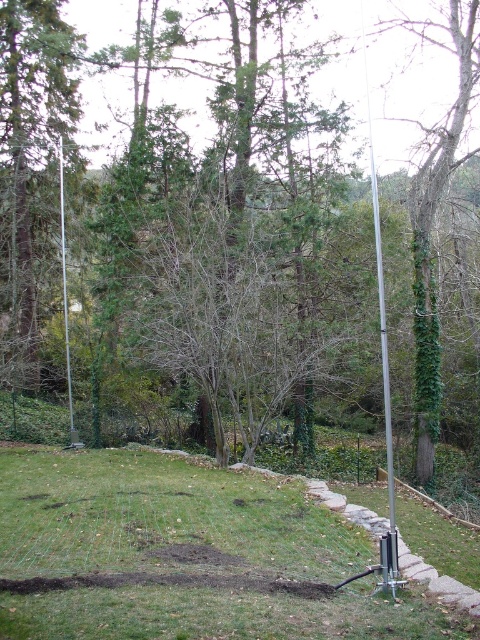
Question: Does green grass at center appear on the left side of silver metallic pole at center?

Choices:
 (A) no
 (B) yes

Answer: (A)

Question: Estimate the real-world distances between objects in this image. Which object is farther from the green grass at center?

Choices:
 (A) silver metallic pole at center
 (B) silver metallic pole at right

Answer: (A)

Question: In this image, where is green grass at center located relative to green ivy-covered tree at right?

Choices:
 (A) above
 (B) below

Answer: (B)

Question: Can you confirm if green ivy-covered tree at right is wider than silver metallic pole at center?

Choices:
 (A) no
 (B) yes

Answer: (A)

Question: Which point is closer to the camera?

Choices:
 (A) (63, 209)
 (B) (93, 570)
 (C) (392, 589)
 (D) (468, 74)

Answer: (C)

Question: Which object is positioned farthest from the green ivy-covered tree at right?

Choices:
 (A) green grass at center
 (B) silver metallic pole at center

Answer: (A)